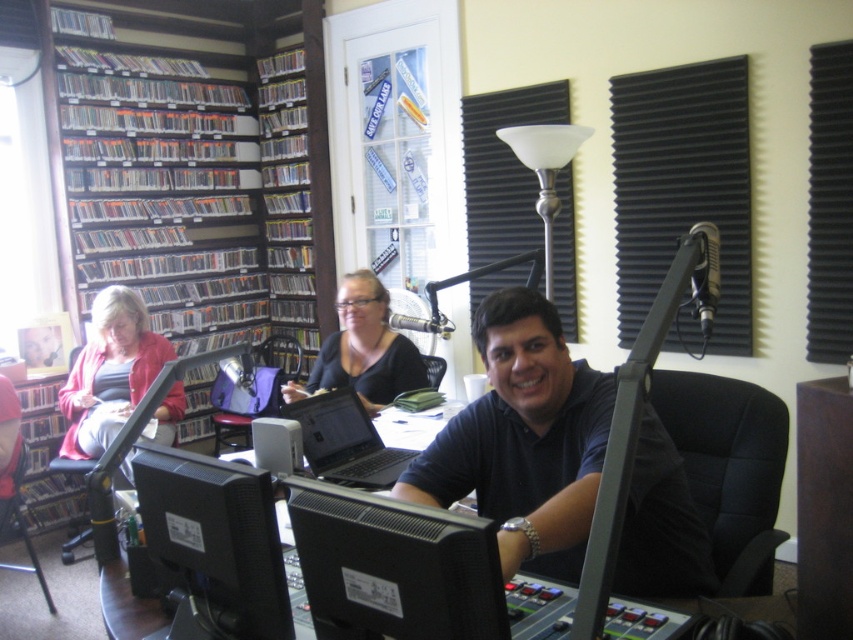
How much distance is there between black matte shirt at center and black glossy monitor at center?

They are 15.29 inches apart.

Is black matte shirt at center bigger than black glossy monitor at center?

Yes.

Who is more distant from viewer, (x=474, y=339) or (x=328, y=509)?

The point (x=474, y=339) is more distant.

Locate an element on the screen. black matte shirt at center is located at coordinates [x=523, y=440].

From the picture: Is matte black shirt at center positioned behind black glossy laptop at center?

That is True.

Who is shorter, matte black shirt at center or black glossy laptop at center?

With less height is black glossy laptop at center.

Is point (299, 387) positioned behind point (323, 413)?

Yes, point (299, 387) is farther from viewer.

Locate an element on the screen. The width and height of the screenshot is (853, 640). matte black shirt at center is located at coordinates (363, 349).

Can you confirm if black matte computer monitor at lower center is taller than black fabric swivel chair at center?

No.

Where is `black matte computer monitor at lower center`? This screenshot has height=640, width=853. black matte computer monitor at lower center is located at coordinates (213, 541).

Identify the location of black matte computer monitor at lower center. The height and width of the screenshot is (640, 853). tap(213, 541).